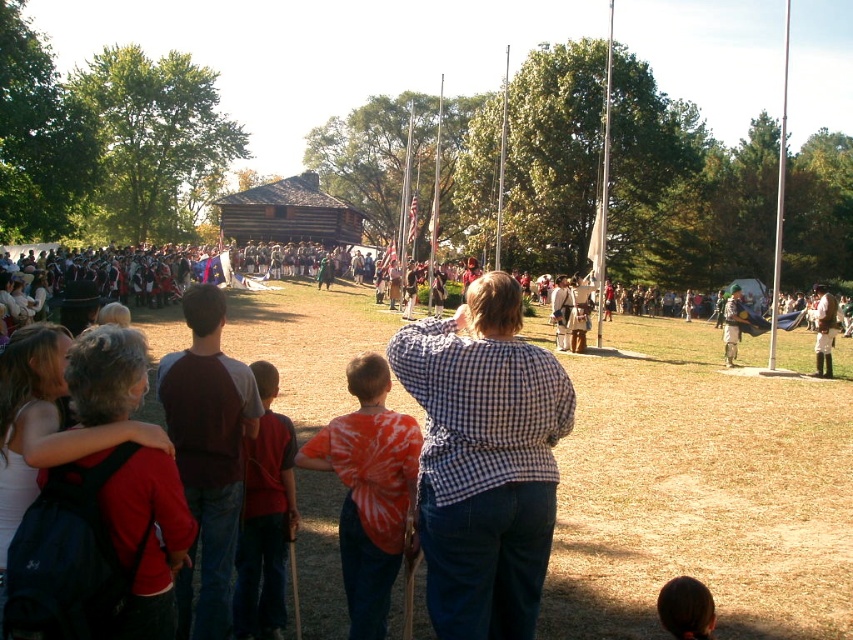
Consider the image. You are standing at the point labeled point (436, 157) and want to walk to the point labeled point (820, 326). Which direction should you face to move towards it?

Since point (820, 326) is closer to the viewer than point (436, 157), you should face towards the direction of the viewer to move towards it.

You are standing at the edge of the historical reenactment field and see the brown leather boots at lower right and the metallic flag pole at center. Which object is positioned lower in the image?

The brown leather boots at lower right is positioned lower than the metallic flag pole at center in the image.